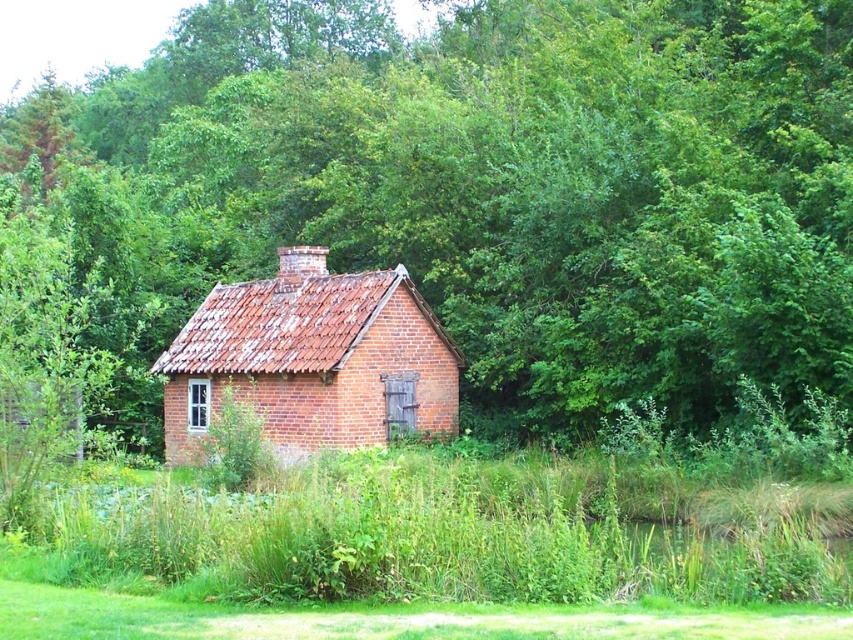
From the picture: Which of these two, green leafy tree at center or red brick cottage at center, stands taller?

With more height is green leafy tree at center.

Is green leafy tree at center to the right of red brick cottage at center from the viewer's perspective?

No, green leafy tree at center is not to the right of red brick cottage at center.

Find the location of a particular element. This screenshot has width=853, height=640. green leafy tree at center is located at coordinates (488, 188).

Find the location of a particular element. green leafy tree at center is located at coordinates point(488,188).

Can you confirm if green grass at center is wider than red brick cottage at center?

Yes.

Is green grass at center further to the viewer compared to red brick cottage at center?

No, green grass at center is closer to the viewer.

Between point (503, 560) and point (167, 435), which one is positioned behind?

The point (167, 435) is behind.

Locate an element on the screen. The image size is (853, 640). green grass at center is located at coordinates (412, 561).

Does green leafy tree at center appear on the right side of green grass at center?

Incorrect, green leafy tree at center is not on the right side of green grass at center.

Does green leafy tree at center have a lesser width compared to green grass at center?

No, green leafy tree at center is not thinner than green grass at center.

Measure the distance between green leafy tree at center and camera.

The distance of green leafy tree at center from camera is 60.11 feet.

This screenshot has height=640, width=853. In order to click on green leafy tree at center in this screenshot , I will do `click(488, 188)`.